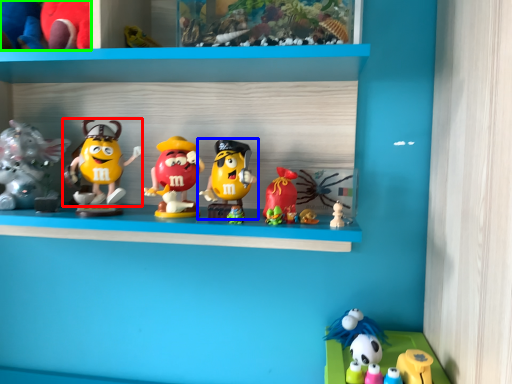
Question: Which is nearer to the toy (highlighted by a red box)? toy (highlighted by a blue box) or toy (highlighted by a green box).

Choices:
 (A) toy
 (B) toy

Answer: (A)